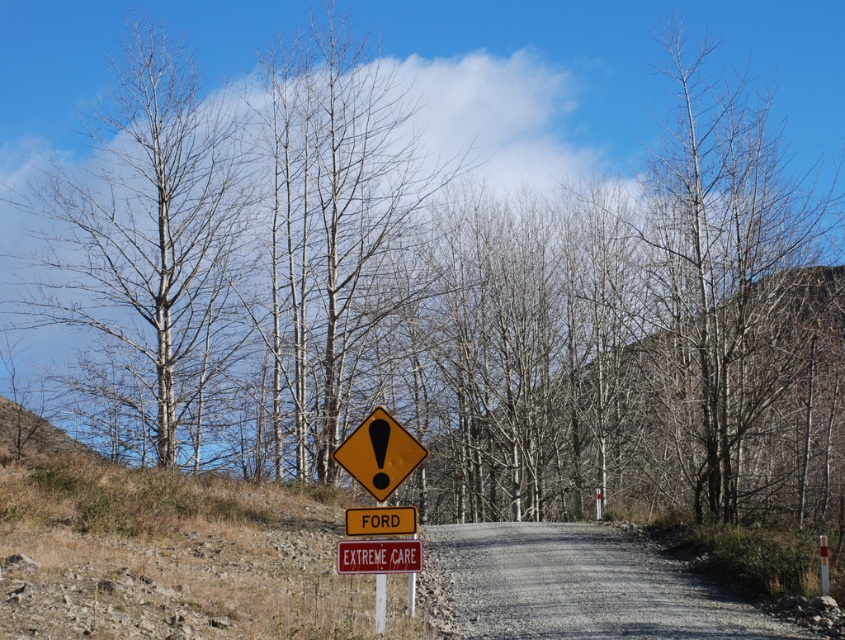
You are driving a car and see the yellow matte triangle at center and the yellow reflective plastic sign at center ahead on the road. Which one will you see first as you approach them?

The yellow matte triangle at center will be seen first because it is closer to the viewer than the yellow reflective plastic sign at center.

You are driving along the gravel road and see the yellow matte triangle at center and the yellow reflective plastic sign at center ahead. Which one is positioned more to the right side from your viewpoint?

The yellow matte triangle at center is positioned to the right of the yellow reflective plastic sign at center, so the yellow matte triangle at center is more to the right side.